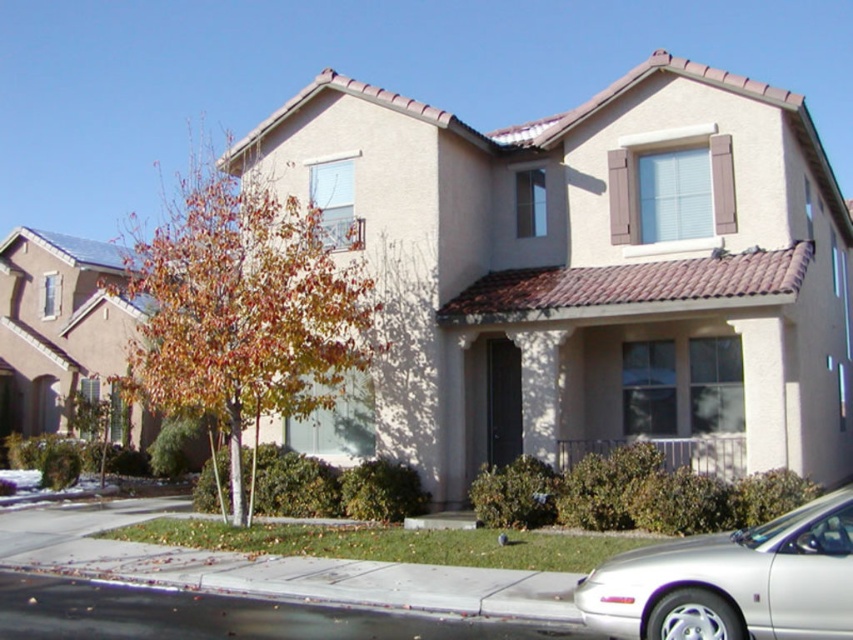
Question: Can you confirm if autumn leaves at left is positioned to the right of silver metallic sedan at lower right?

Choices:
 (A) yes
 (B) no

Answer: (B)

Question: Which object is the closest to the autumn leaves at left?

Choices:
 (A) black asphalt curb at lower left
 (B) silver metallic sedan at lower right

Answer: (B)

Question: Can you confirm if autumn leaves at left is positioned to the right of black asphalt curb at lower left?

Choices:
 (A) no
 (B) yes

Answer: (A)

Question: Observing the image, what is the correct spatial positioning of autumn leaves at left in reference to silver metallic sedan at lower right?

Choices:
 (A) below
 (B) above

Answer: (B)

Question: Which object is the closest to the autumn leaves at left?

Choices:
 (A) silver metallic sedan at lower right
 (B) black asphalt curb at lower left

Answer: (A)

Question: Based on their relative distances, which object is farther from the black asphalt curb at lower left?

Choices:
 (A) silver metallic sedan at lower right
 (B) autumn leaves at left

Answer: (B)